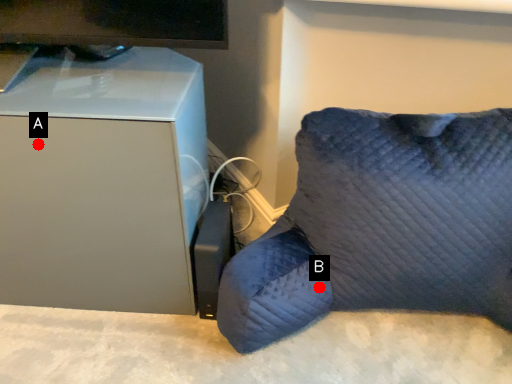
Question: Two points are circled on the image, labeled by A and B beside each circle. Which point appears closest to the camera in this image?

Choices:
 (A) A is closer
 (B) B is closer

Answer: (A)